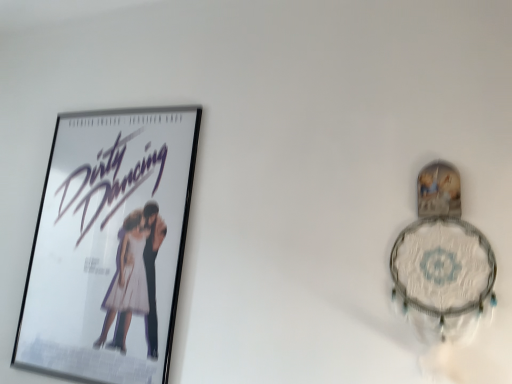
Describe the element at coordinates (110, 246) in the screenshot. The width and height of the screenshot is (512, 384). I see `metallic silver picture frame at left` at that location.

The image size is (512, 384). Identify the location of metallic silver picture frame at left. (110, 246).

From the picture: Measure the distance between point (146, 194) and camera.

Point (146, 194) and camera are 1.42 meters apart.

Locate an element on the screen. The height and width of the screenshot is (384, 512). metallic silver picture frame at left is located at coordinates (110, 246).